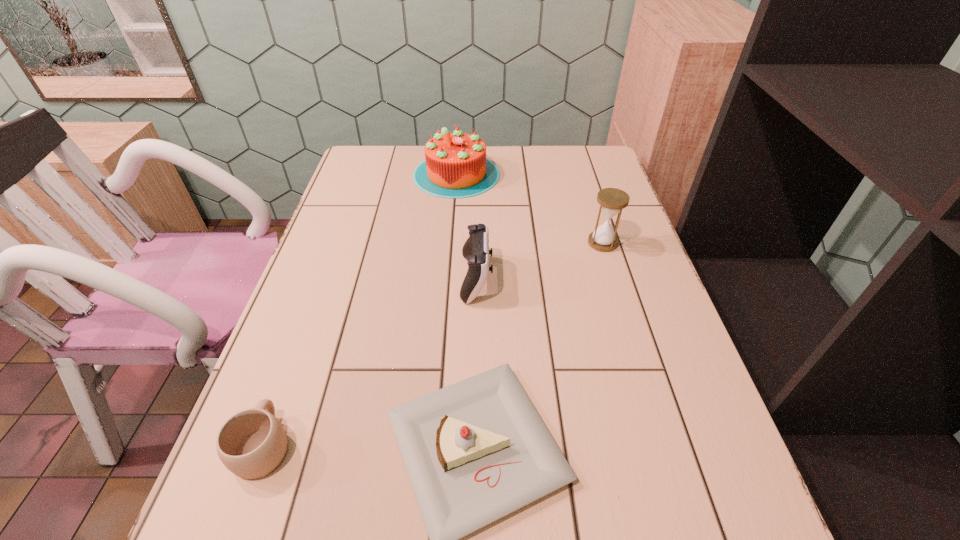
Identify the location of free spot that satisfies the following two spatial constraints: 1. on the side of the hourglass with the handle; 2. on the right side of the mug. The image size is (960, 540). (337, 243).